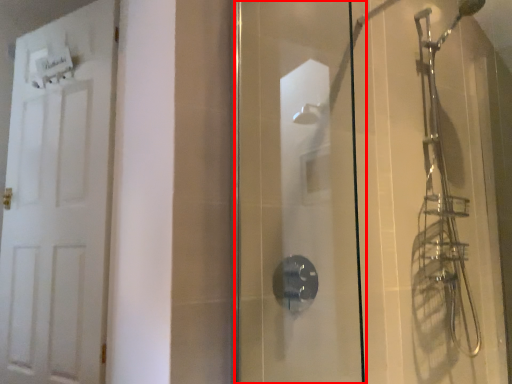
Question: From the image's perspective, what is the correct spatial relationship of screen door (annotated by the red box) in relation to door?

Choices:
 (A) below
 (B) above

Answer: (A)